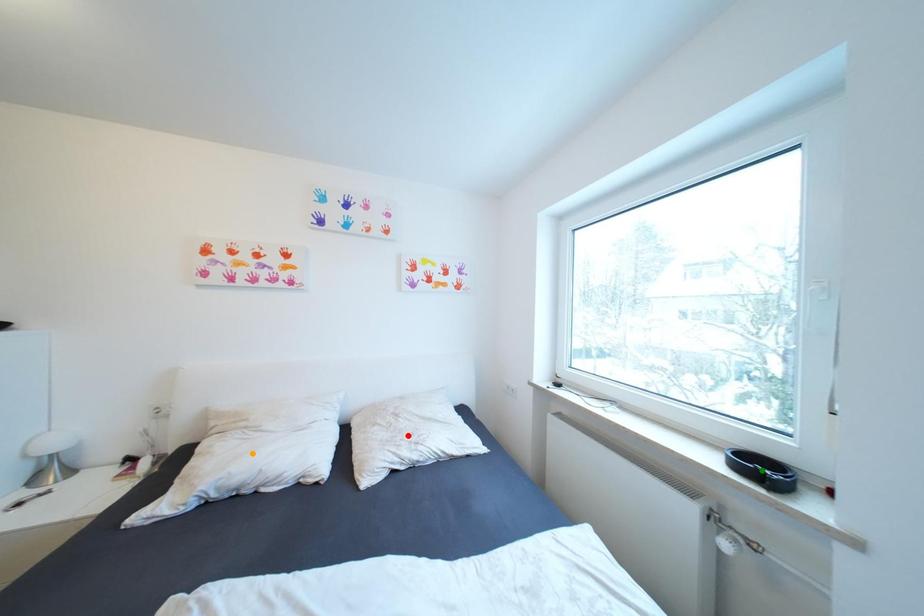
Order these from nearest to farthest:
green point, red point, orange point

green point
orange point
red point